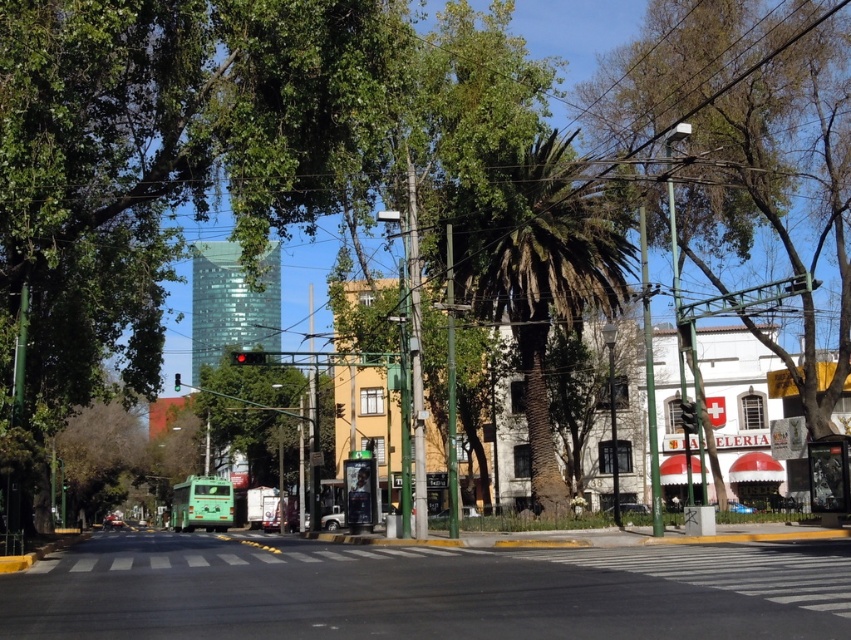
Question: Can you confirm if green leafy palm tree at center is smaller than green matte truck at center?

Choices:
 (A) no
 (B) yes

Answer: (A)

Question: Which object is the farthest from the metallic silver car at center?

Choices:
 (A) green matte truck at center
 (B) black asphalt road at center
 (C) green leafy palm tree at center

Answer: (A)

Question: Is green leafy palm tree at center smaller than green matte truck at center?

Choices:
 (A) no
 (B) yes

Answer: (A)

Question: Can you confirm if metallic silver car at center is positioned above green matte truck at center?

Choices:
 (A) no
 (B) yes

Answer: (B)

Question: Which point appears farthest from the camera in this image?

Choices:
 (A) (541, 612)
 (B) (627, 513)
 (C) (117, 520)

Answer: (C)

Question: Which of the following is the farthest from the observer?

Choices:
 (A) green leafy palm tree at center
 (B) green matte truck at center
 (C) metallic silver car at center
 (D) black asphalt road at center

Answer: (B)